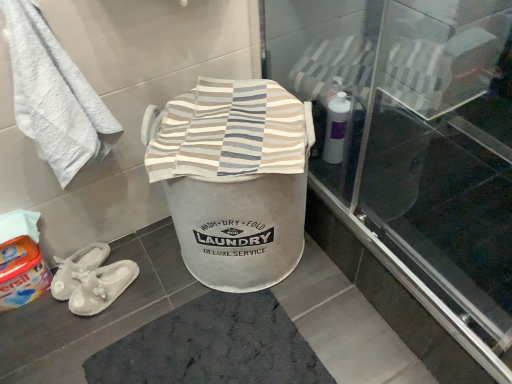
Identify the location of blank space situated above dark gray textured bath mat at center (from a real-world perspective). Image resolution: width=512 pixels, height=384 pixels. (219, 345).